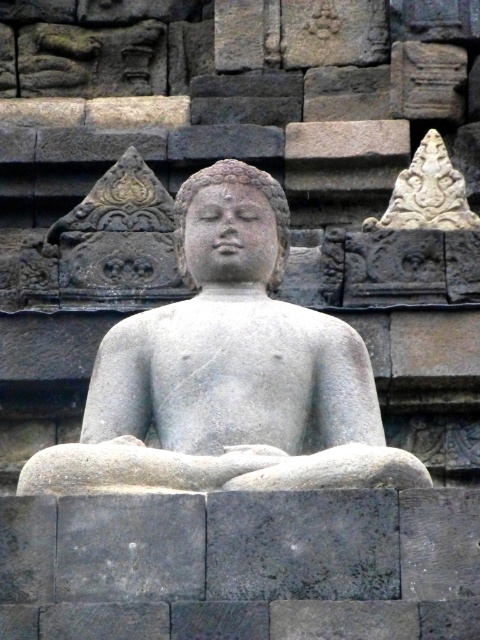
You are an art conservator examining the image. You need to document the relative positions of the gray stone statue at center and the carved stone ornament at upper center. Which object is positioned to the left of the other?

The gray stone statue at center is to the left of carved stone ornament at upper center.

You are an art conservator examining the statue. You notice two elements on the statue, the carved stone ornament at upper center and the gray stone head at center. Which of these two elements is positioned to the right side of the other?

The carved stone ornament at upper center is to the right of the gray stone head at center.